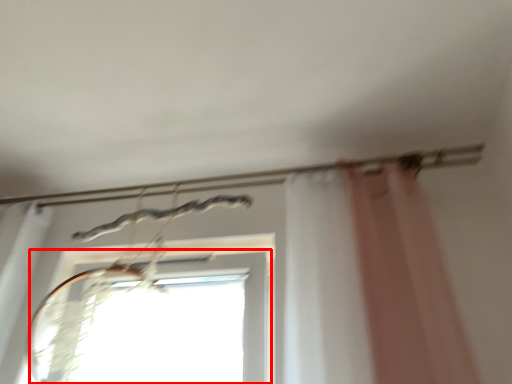
Question: Considering the relative positions of window (annotated by the red box) and clothesline in the image provided, where is window (annotated by the red box) located with respect to the staircase?

Choices:
 (A) right
 (B) left

Answer: (B)